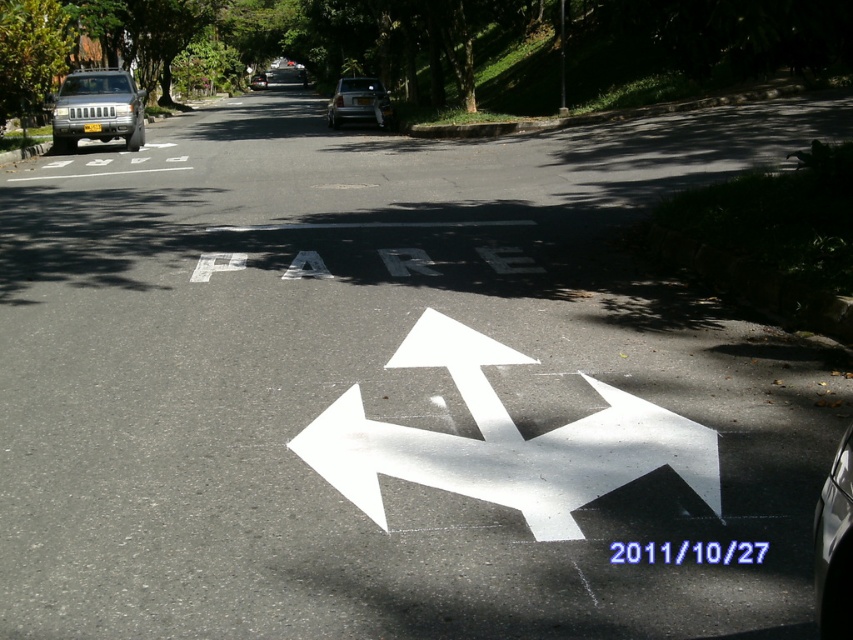
You are standing at the center of the road and want to park your car in the closest available parking spot. The closest parking spot is located at point A. Where is the glossy silver car at lower right in relation to point A?

The glossy silver car at lower right is located at point A.

You are a pedestrian standing at the edge of the road where the PARE sign is painted. You need to cross the road to reach the other side. There are two vehicles parked nearby, a glossy silver car at lower right and a matte silver suv at left. How far apart are these two vehicles from each other?

The glossy silver car at lower right and the matte silver suv at left are 24.28 meters apart.

You are a pedestrian standing at the crosswalk and see the glossy silver car at lower right and the matte silver suv at left. Which vehicle is closer to you?

The glossy silver car at lower right is closer to you because it has a smaller size compared to the matte silver suv at left.